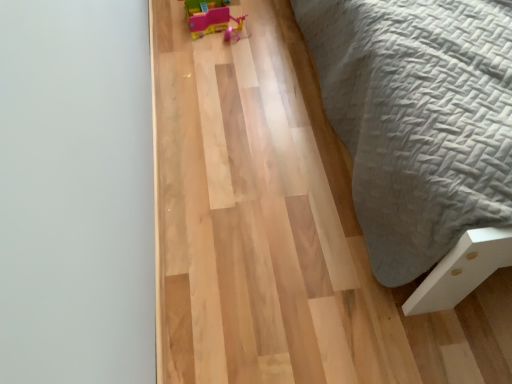
Where is `vacant area that lies to the right of pink plastic toy at upper center`? The image size is (512, 384). vacant area that lies to the right of pink plastic toy at upper center is located at coordinates (273, 26).